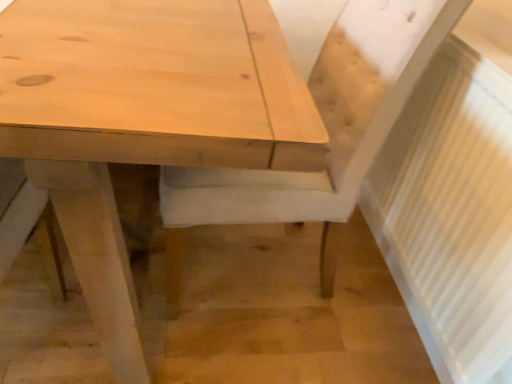
Question: From a real-world perspective, relative to natural wood table at center, is natural wood chair at center vertically above or below?

Choices:
 (A) below
 (B) above

Answer: (B)

Question: Considering their positions, is natural wood chair at center located in front of or behind natural wood table at center?

Choices:
 (A) front
 (B) behind

Answer: (B)

Question: Estimate the real-world distances between objects in this image. Which object is closer to the white textured radiator at right?

Choices:
 (A) natural wood table at center
 (B) natural wood chair at center

Answer: (B)

Question: Considering the real-world distances, which object is farthest from the natural wood chair at center?

Choices:
 (A) white textured radiator at right
 (B) natural wood table at center

Answer: (B)